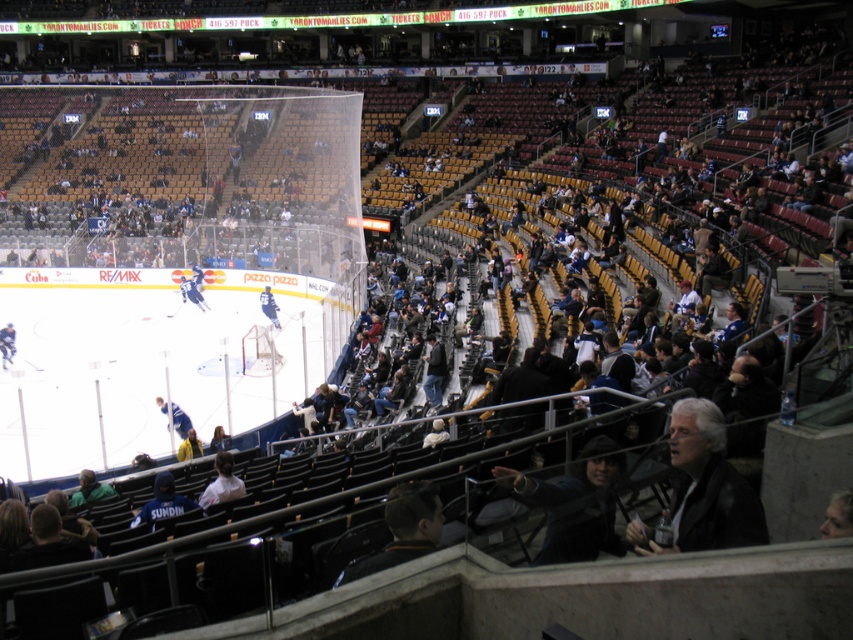
Question: Is black leather jacket at lower center to the right of white fabric shirt at center from the viewer's perspective?

Choices:
 (A) no
 (B) yes

Answer: (B)

Question: Which object appears farthest from the camera in this image?

Choices:
 (A) black hockey player at center
 (B) blue hockey player at center
 (C) black leather jacket at lower center

Answer: (A)

Question: Can you confirm if black hockey player at center is thinner than blue hockey player at center?

Choices:
 (A) no
 (B) yes

Answer: (A)

Question: Is the position of dark blue knit cap at lower left less distant than that of black hockey player at center?

Choices:
 (A) no
 (B) yes

Answer: (B)

Question: Estimate the real-world distances between objects in this image. Which object is closer to the dark blue knit cap at lower left?

Choices:
 (A) blue jersey at center
 (B) black hockey player at center
 (C) black leather jacket at lower center
 (D) blue hockey player at center

Answer: (C)

Question: Based on their relative distances, which object is farther from the blue hockey stick at center?

Choices:
 (A) gray hair at center
 (B) black hockey player at center

Answer: (A)